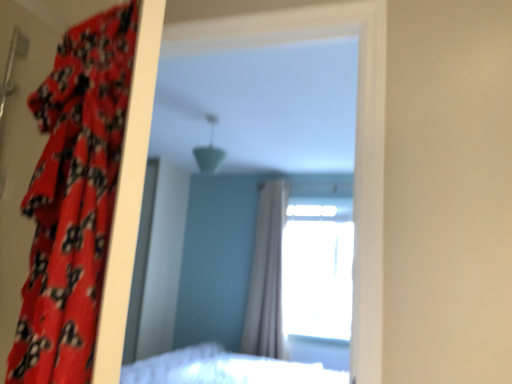
Question: Does matte plastic mirror at center have a greater height compared to transparent glass window at upper center?

Choices:
 (A) yes
 (B) no

Answer: (B)

Question: From a real-world perspective, does matte plastic mirror at center stand above transparent glass window at upper center?

Choices:
 (A) yes
 (B) no

Answer: (A)

Question: Are matte plastic mirror at center and transparent glass window at upper center located far from each other?

Choices:
 (A) yes
 (B) no

Answer: (B)

Question: Is matte plastic mirror at center in contact with transparent glass window at upper center?

Choices:
 (A) yes
 (B) no

Answer: (B)

Question: From a real-world perspective, is matte plastic mirror at center physically below transparent glass window at upper center?

Choices:
 (A) yes
 (B) no

Answer: (B)

Question: Considering the relative positions of matte plastic mirror at center and transparent glass window at upper center in the image provided, is matte plastic mirror at center behind transparent glass window at upper center?

Choices:
 (A) no
 (B) yes

Answer: (A)

Question: Is transparent glass window at upper center facing towards red floral fabric curtain at left, the 2th curtain positioned from the back?

Choices:
 (A) no
 (B) yes

Answer: (B)

Question: From the image's perspective, would you say transparent glass window at upper center is shown under red floral fabric curtain at left, the 1th curtain viewed from the front?

Choices:
 (A) no
 (B) yes

Answer: (B)

Question: Does transparent glass window at upper center have a larger size compared to red floral fabric curtain at left, placed as the second curtain when sorted from right to left?

Choices:
 (A) no
 (B) yes

Answer: (B)

Question: Can you see transparent glass window at upper center touching red floral fabric curtain at left, the 2th curtain positioned from the back?

Choices:
 (A) no
 (B) yes

Answer: (A)

Question: Is transparent glass window at upper center positioned before red floral fabric curtain at left, the 1th curtain viewed from the front?

Choices:
 (A) yes
 (B) no

Answer: (B)

Question: Does transparent glass window at upper center have a greater height compared to red floral fabric curtain at left, the first curtain from the left?

Choices:
 (A) yes
 (B) no

Answer: (A)

Question: Considering the relative sizes of transparent glass window at upper center and white sheer curtain at center, the 2th curtain viewed from the front, in the image provided, is transparent glass window at upper center taller than white sheer curtain at center, the 2th curtain viewed from the front,?

Choices:
 (A) yes
 (B) no

Answer: (B)